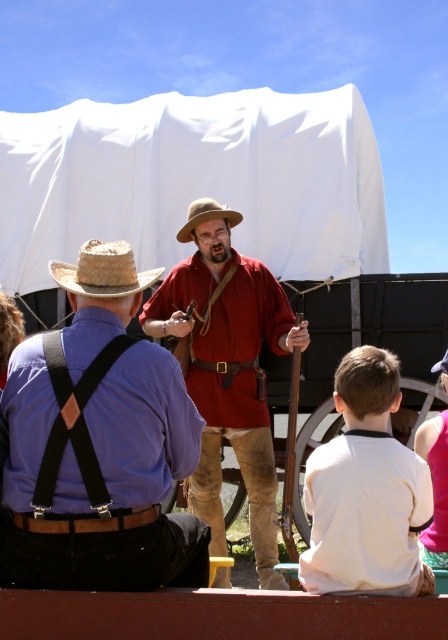
Question: Among these objects, which one is nearest to the camera?

Choices:
 (A) tan straw cowboy hat at center
 (B) strawmaterial/texturehat at center
 (C) pink fabric shirt at lower right
 (D) matte red shirt at center

Answer: (C)

Question: Is straw hat at center to the left of tan straw cowboy hat at center from the viewer's perspective?

Choices:
 (A) no
 (B) yes

Answer: (B)

Question: Is matte red shirt at center above strawhat at left?

Choices:
 (A) yes
 (B) no

Answer: (B)

Question: Which of these objects is positioned farthest from the straw hat at center?

Choices:
 (A) tan straw cowboy hat at center
 (B) pink fabric shirt at lower right
 (C) strawmaterial/texturehat at center
 (D) strawhat at left

Answer: (A)

Question: Is matte red shirt at center to the left of pink fabric shirt at lower right from the viewer's perspective?

Choices:
 (A) no
 (B) yes

Answer: (B)

Question: Which object is farther from the camera taking this photo?

Choices:
 (A) straw hat at center
 (B) tan straw cowboy hat at center
 (C) pink fabric shirt at lower right

Answer: (B)